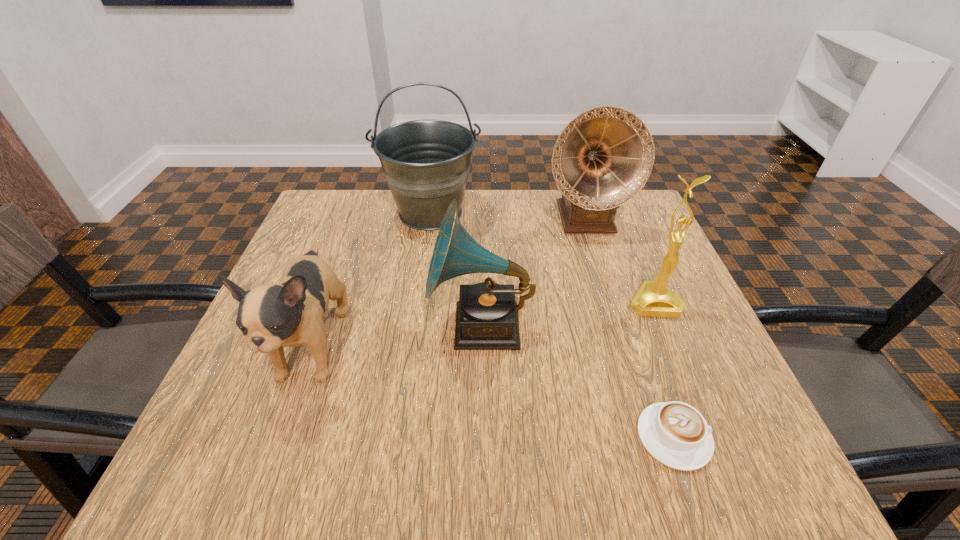
Identify the location of vacant space situated from the horn of the left phonograph_record. (316, 326).

You are a GUI agent. You are given a task and a screenshot of the screen. Output one action in this format:
    pyautogui.click(x=<x>, y=<y>)
    Task: Click on the vacant region located 0.230m from the horn of the left phonograph_record
    The height and width of the screenshot is (540, 960).
    Given the screenshot: What is the action you would take?
    316,326

Where is `vacant space situated with the handle on the right side of the cappuccino`? vacant space situated with the handle on the right side of the cappuccino is located at coordinates (754, 437).

The image size is (960, 540). I want to click on bucket located at the far edge, so 426,163.

This screenshot has height=540, width=960. I want to click on phonograph record that is at the far edge, so click(603, 157).

This screenshot has height=540, width=960. In order to click on object that is at the near edge in this screenshot , I will do `click(676, 434)`.

You are a GUI agent. You are given a task and a screenshot of the screen. Output one action in this format:
    pyautogui.click(x=<x>, y=<y>)
    Task: Click on the object that is at the left edge
    
    Given the screenshot: What is the action you would take?
    pyautogui.click(x=272, y=316)

You are a GUI agent. You are given a task and a screenshot of the screen. Output one action in this format:
    pyautogui.click(x=<x>, y=<y>)
    Task: Click on the phonograph record present at the right edge
    Image resolution: width=960 pixels, height=540 pixels.
    Given the screenshot: What is the action you would take?
    pyautogui.click(x=603, y=157)

Locate an element on the screen. award located in the right edge section of the desktop is located at coordinates (653, 299).

You are a GUI agent. You are given a task and a screenshot of the screen. Output one action in this format:
    pyautogui.click(x=<x>, y=<y>)
    Task: Click on the cappuccino positioned at the right edge
    
    Given the screenshot: What is the action you would take?
    pyautogui.click(x=676, y=434)